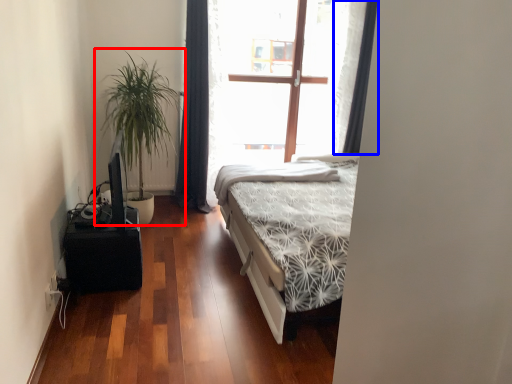
Question: Which point is closer to the camera, houseplant (highlighted by a red box) or curtain (highlighted by a blue box)?

Choices:
 (A) houseplant
 (B) curtain

Answer: (A)